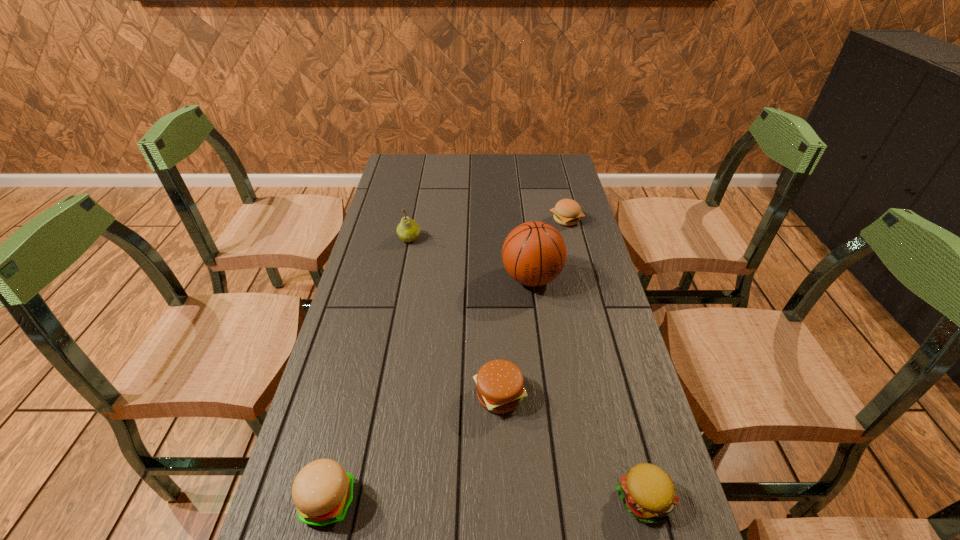
Locate an element on the screen. This screenshot has width=960, height=540. free space at the far left corner of the desktop is located at coordinates (384, 182).

Locate an element on the screen. This screenshot has height=540, width=960. unoccupied area between the fifth shortest object and the farthest hamburger is located at coordinates (488, 230).

You are a GUI agent. You are given a task and a screenshot of the screen. Output one action in this format:
    pyautogui.click(x=<x>, y=<y>)
    Task: Click on the free space that is in between the second farthest hamburger and the farthest hamburger
    The width and height of the screenshot is (960, 540).
    Given the screenshot: What is the action you would take?
    pyautogui.click(x=533, y=308)

Find the location of a particular element. Image resolution: width=960 pixels, height=540 pixels. empty location between the third hamburger from right to left and the farthest object is located at coordinates (533, 308).

The image size is (960, 540). I want to click on vacant point located between the pear and the basketball, so click(x=470, y=258).

Where is `empty space that is in between the fifth shortest object and the farthest object`? This screenshot has height=540, width=960. empty space that is in between the fifth shortest object and the farthest object is located at coordinates (488, 230).

Locate an element on the screen. vacant space that's between the pear and the tallest object is located at coordinates pos(470,258).

This screenshot has height=540, width=960. In order to click on object that is the third closest to the second tallest object in this screenshot , I will do (x=500, y=389).

Select which object appears as the closest to the farthest object. Please provide its 2D coordinates. Your answer should be formatted as a tuple, i.e. [(x, y)], where the tuple contains the x and y coordinates of a point satisfying the conditions above.

[(534, 253)]

Locate an element on the screen. Image resolution: width=960 pixels, height=540 pixels. the second closest hamburger to the farthest hamburger is located at coordinates (648, 493).